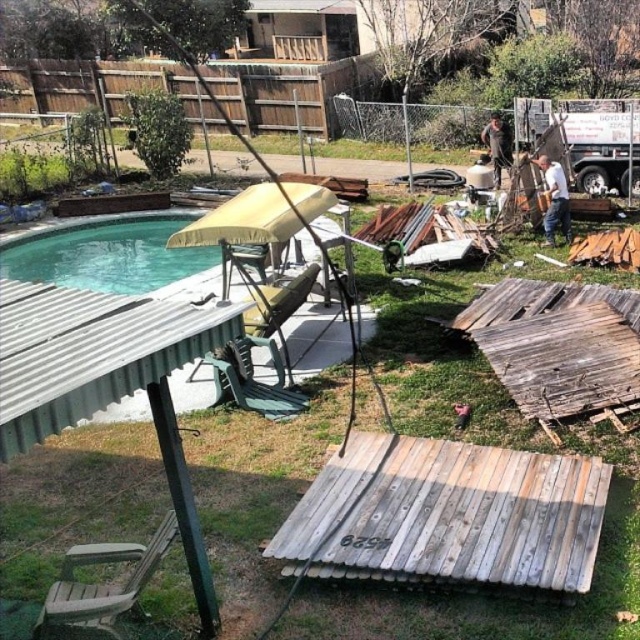
Is green grass at center positioned before brown leather jacket at upper right?

Yes, it is.

Who is more forward, [88,547] or [497,176]?

Positioned in front is point [88,547].

Who is more forward, (326,576) or (499,134)?

Positioned in front is point (326,576).

This screenshot has height=640, width=640. Find the location of `green grass at center`. green grass at center is located at coordinates (100, 365).

In the scene shown: Who is positioned more to the right, green grass at center or green plastic pool at center?

Positioned to the right is green grass at center.

Who is higher up, green grass at center or green plastic pool at center?

Positioned higher is green plastic pool at center.

Where is `green grass at center`? green grass at center is located at coordinates point(100,365).

This screenshot has width=640, height=640. What are the coordinates of `green grass at center` in the screenshot? It's located at (100, 365).

Does white matte shirt at upper right have a lesser height compared to brown leather jacket at upper right?

Indeed, white matte shirt at upper right has a lesser height compared to brown leather jacket at upper right.

Who is higher up, white matte shirt at upper right or brown leather jacket at upper right?

brown leather jacket at upper right is higher up.

Image resolution: width=640 pixels, height=640 pixels. Identify the location of white matte shirt at upper right. [554, 198].